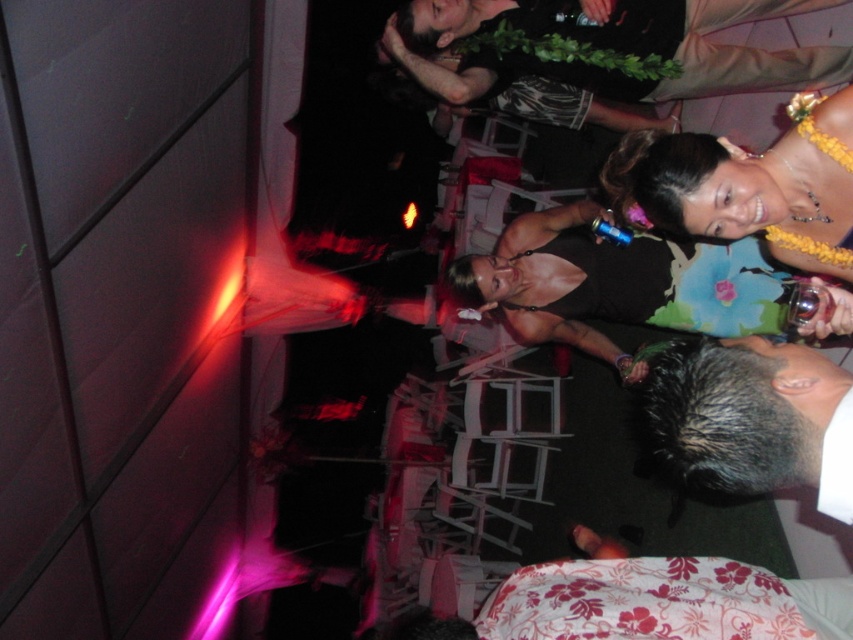
Does gray hair at lower right have a greater width compared to floral fabric lei at upper right?

Incorrect, gray hair at lower right's width does not surpass floral fabric lei at upper right's.

Between gray hair at lower right and floral fabric lei at upper right, which one appears on the left side from the viewer's perspective?

gray hair at lower right

Between point (840, 500) and point (753, 177), which one is positioned behind?

The point (753, 177) is behind.

The width and height of the screenshot is (853, 640). I want to click on gray hair at lower right, so click(x=753, y=419).

Does floral fabric dress at center have a greater height compared to floral fabric lei at upper right?

Yes, floral fabric dress at center is taller than floral fabric lei at upper right.

Is floral fabric dress at center bigger than floral fabric lei at upper right?

Indeed, floral fabric dress at center has a larger size compared to floral fabric lei at upper right.

The width and height of the screenshot is (853, 640). Find the location of `floral fabric dress at center`. floral fabric dress at center is located at coordinates (610, 284).

You are a GUI agent. You are given a task and a screenshot of the screen. Output one action in this format:
    pyautogui.click(x=<x>, y=<y>)
    Task: Click on the floral fabric dress at center
    The width and height of the screenshot is (853, 640).
    Given the screenshot: What is the action you would take?
    pyautogui.click(x=610, y=284)

Is light brown leather jacket at upper center taller than floral fabric dress at center?

In fact, light brown leather jacket at upper center may be shorter than floral fabric dress at center.

Does light brown leather jacket at upper center have a lesser width compared to floral fabric dress at center?

Incorrect, light brown leather jacket at upper center's width is not less than floral fabric dress at center's.

Which is in front, point (457, 65) or point (518, 250)?

Point (518, 250) is more forward.

You are a GUI agent. You are given a task and a screenshot of the screen. Output one action in this format:
    pyautogui.click(x=<x>, y=<y>)
    Task: Click on the light brown leather jacket at upper center
    
    Given the screenshot: What is the action you would take?
    pyautogui.click(x=608, y=48)